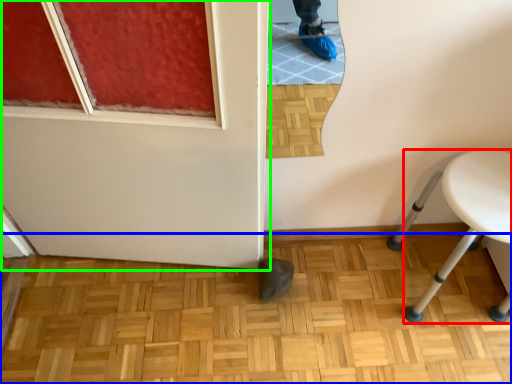
Question: Which is nearer to the furniture (highlighted by a red box)? hardwood (highlighted by a blue box) or door (highlighted by a green box).

Choices:
 (A) hardwood
 (B) door

Answer: (A)